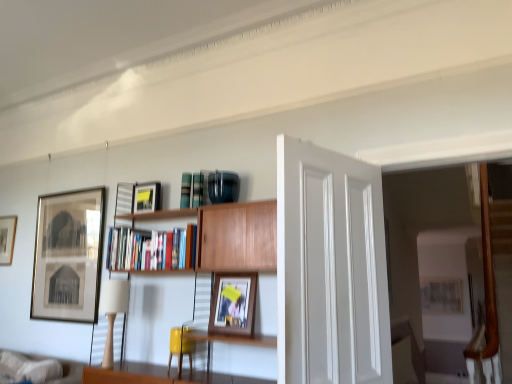
The image size is (512, 384). What are the coordinates of `empty space that is ontop of matte black picture frame at left, marked as the 3th picture frame in a front-to-back arrangement (from a real-world perspective)` in the screenshot? It's located at (77, 188).